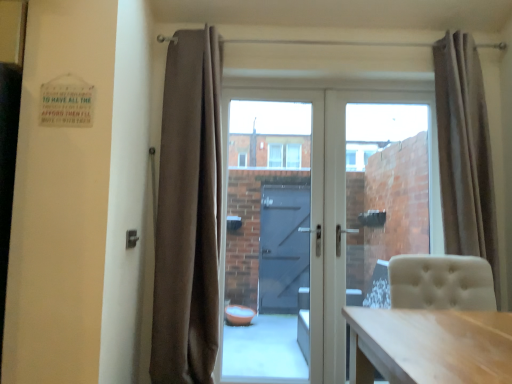
Question: Considering the relative sizes of beige fabric curtain at right, arranged as the 2th curtain when viewed from the left, and transparent glass door at center, marked as the first glass door in a left-to-right arrangement, in the image provided, is beige fabric curtain at right, arranged as the 2th curtain when viewed from the left, wider than transparent glass door at center, marked as the first glass door in a left-to-right arrangement,?

Choices:
 (A) no
 (B) yes

Answer: (B)

Question: Does beige fabric curtain at right, arranged as the 2th curtain when viewed from the left, appear on the left side of transparent glass door at center, the second glass door when ordered from right to left?

Choices:
 (A) yes
 (B) no

Answer: (B)

Question: Would you consider beige fabric curtain at right, arranged as the 2th curtain when viewed from the left, to be distant from transparent glass door at center, marked as the first glass door in a left-to-right arrangement?

Choices:
 (A) no
 (B) yes

Answer: (A)

Question: From a real-world perspective, is beige fabric curtain at right, which is the first curtain from right to left, on top of transparent glass door at center, the second glass door when ordered from right to left?

Choices:
 (A) yes
 (B) no

Answer: (A)

Question: From the image's perspective, does beige fabric curtain at right, which is the first curtain from right to left, appear lower than transparent glass door at center, the second glass door when ordered from right to left?

Choices:
 (A) no
 (B) yes

Answer: (A)

Question: Could you tell me if beige fabric curtain at right, which is the first curtain from right to left, is facing transparent glass door at center, marked as the first glass door in a left-to-right arrangement?

Choices:
 (A) no
 (B) yes

Answer: (A)

Question: Is transparent glass door at center, the second glass door when ordered from right to left, next to white glass door at center?

Choices:
 (A) no
 (B) yes

Answer: (A)

Question: Can white glass door at center be found inside transparent glass door at center, the second glass door when ordered from right to left?

Choices:
 (A) no
 (B) yes

Answer: (B)

Question: Does transparent glass door at center, marked as the first glass door in a left-to-right arrangement, turn towards white glass door at center?

Choices:
 (A) no
 (B) yes

Answer: (B)

Question: Is the position of transparent glass door at center, the second glass door when ordered from right to left, more distant than that of white glass door at center?

Choices:
 (A) yes
 (B) no

Answer: (B)

Question: Would you consider transparent glass door at center, marked as the first glass door in a left-to-right arrangement, to be distant from white glass door at center?

Choices:
 (A) no
 (B) yes

Answer: (A)

Question: Can you confirm if transparent glass door at center, marked as the first glass door in a left-to-right arrangement, is shorter than white glass door at center?

Choices:
 (A) no
 (B) yes

Answer: (B)

Question: From a real-world perspective, is transparent glass door at center, the second glass door when ordered from right to left, located higher than beige fabric curtain at right, arranged as the 2th curtain when viewed from the left?

Choices:
 (A) no
 (B) yes

Answer: (A)